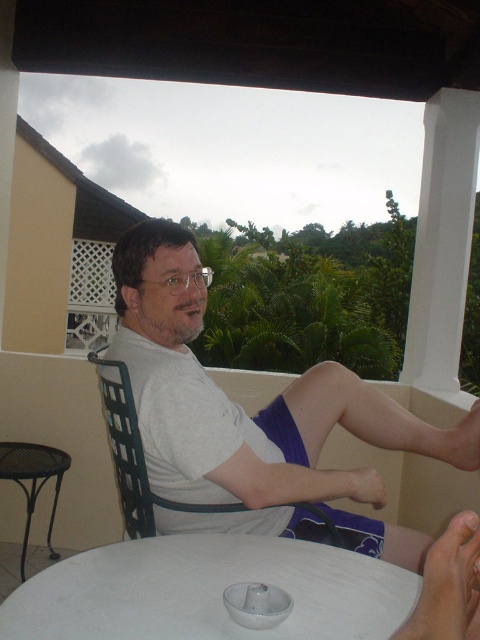
You are standing on the balcony and want to place a small plant between the two points marked as point (163, 250) and point (122, 400). Which point should the plant be closer to in order to be centered between them?

The plant should be closer to point (122, 400) because point (163, 250) is in front of point (122, 400), so the midpoint would be closer to the latter point.

Based on the photo, you are a delivery person trying to place a package on the white cotton shirt at center and the black plastic chair at center. Which object should you place the package on if you want it to be higher?

The white cotton shirt at center is located above the black plastic chair at center, so you should place the package on the white cotton shirt at center to have it higher.

You are standing on the balcony and want to reach the point marked at coordinates (168, 420). If your arm can extend 1.2 meters, will you be able to reach it?

The point at coordinates (168, 420) is 1.34 meters away from the viewer. Since your arm can only extend 1.2 meters, you cannot reach it.